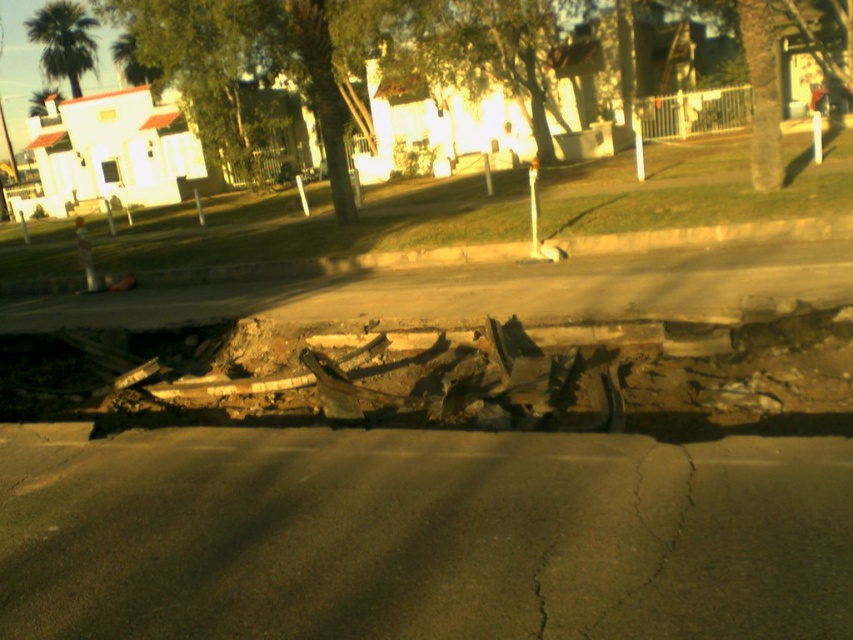
Is rusty concrete rubble at center behind brown concrete curb at upper center?

No, it is in front of brown concrete curb at upper center.

Is point (744, 362) farther from camera compared to point (399, 268)?

No, it is not.

Locate an element on the screen. This screenshot has width=853, height=640. rusty concrete rubble at center is located at coordinates (439, 372).